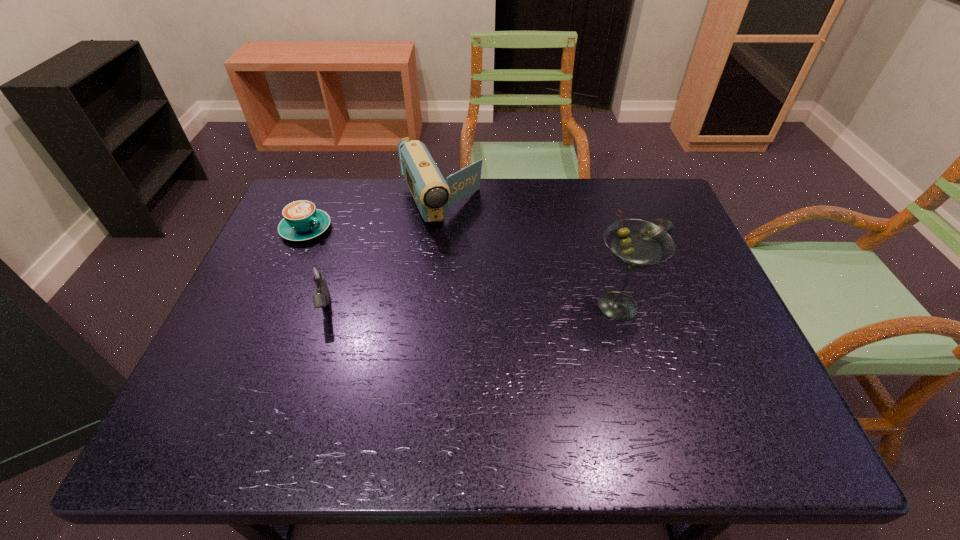
At what (x,y) coordinates should I click in order to perform the action: click on the third tallest object. Please return your answer as a coordinate pair (x, y). This screenshot has width=960, height=540. Looking at the image, I should click on (317, 273).

Locate an element on the screen. the fourth object from right to left is located at coordinates (317, 273).

Locate an element on the screen. This screenshot has height=540, width=960. the fourth object from left to right is located at coordinates (636, 244).

Find the location of a particular element. Image resolution: width=960 pixels, height=540 pixels. the tallest object is located at coordinates (636, 244).

The width and height of the screenshot is (960, 540). What are the coordinates of `the rightmost object` in the screenshot? It's located at (667, 225).

Identify the location of the shortest object. This screenshot has height=540, width=960. (667, 225).

The height and width of the screenshot is (540, 960). In order to click on camcorder in this screenshot , I will do `click(433, 195)`.

The height and width of the screenshot is (540, 960). What are the coordinates of `the third object from left to right` in the screenshot? It's located at (433, 195).

I want to click on the leftmost object, so click(x=302, y=221).

You are a GUI agent. You are given a task and a screenshot of the screen. Output one action in this format:
    pyautogui.click(x=<x>, y=<y>)
    Task: Click on the cappuccino
    The width and height of the screenshot is (960, 540).
    Given the screenshot: What is the action you would take?
    pyautogui.click(x=302, y=221)